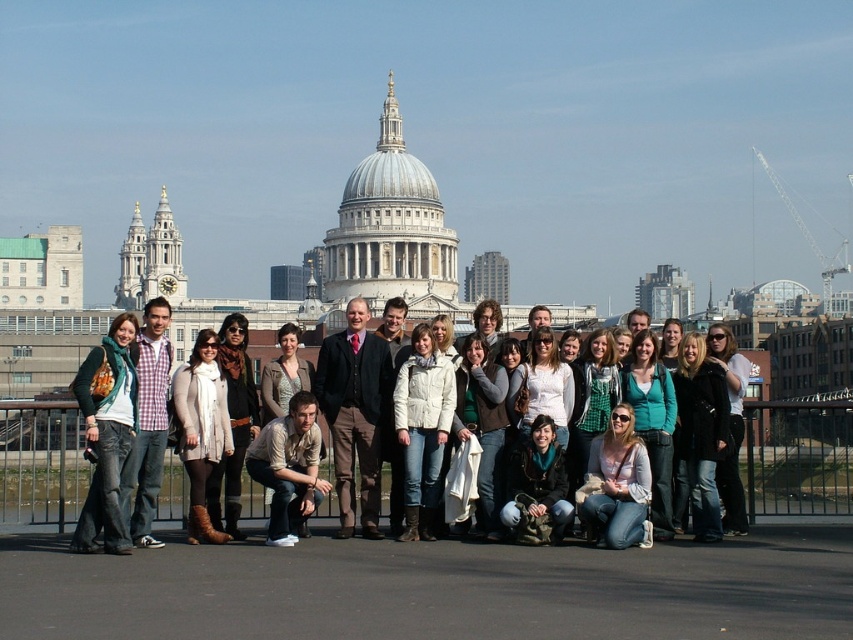
You are a photographer standing at the camera position. You want to take a photo that includes both the khaki cotton shirt at center and the matte black jacket at center. How far apart are these two items in feet?

The khaki cotton shirt at center is 43.09 feet away from the matte black jacket at center.